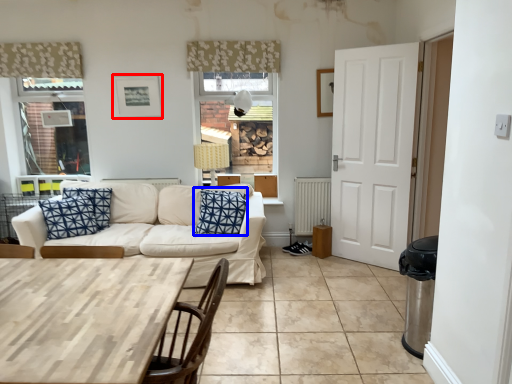
Question: Which object appears farthest to the camera in this image, picture frame (highlighted by a red box) or pillow (highlighted by a blue box)?

Choices:
 (A) picture frame
 (B) pillow

Answer: (A)